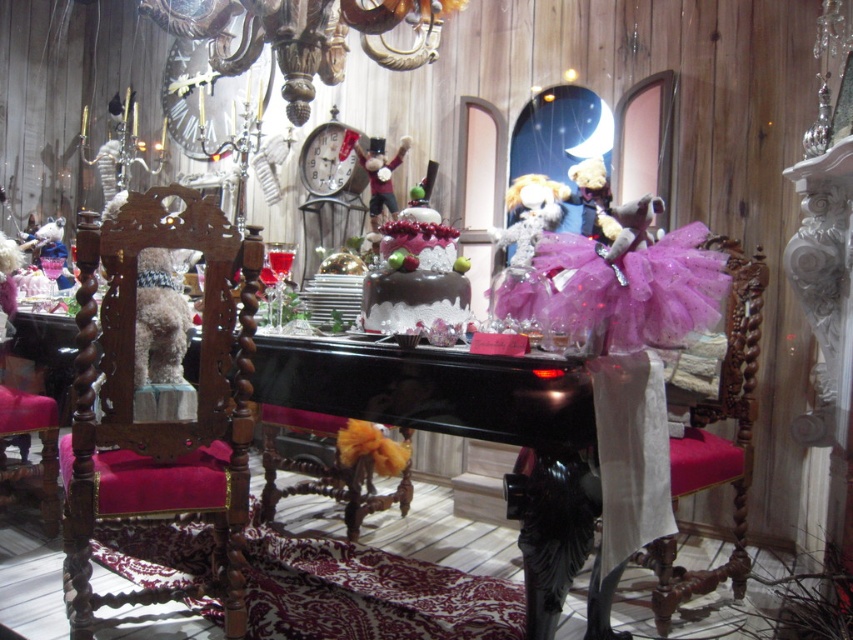
You are a photographer setting up for a photoshoot at this stage. You need to place a 1.2 meter wide backdrop behind the purple tulle dress at center and the fuzzy plush toy at center. Can both items fit side by side on the backdrop without overlapping?

The purple tulle dress at center is wider than the fuzzy plush toy at center. Since the backdrop is 1.2 meters wide, it depends on their combined widths. However, the description only states the dress is wider, not the exact measurements. Without knowing the exact widths, we cannot confirm if they fit together.

You are a stagehand preparing to move items on the piano. You need to place a 6 inch wide decorative plate between the fuzzy plush toy at center and the velvet teddy bear at center. Is there enough space?

The fuzzy plush toy at center is 6.23 inches away from the velvet teddy bear at center, so yes, there is enough space to place a 6 inch wide decorative plate between them since the distance is slightly larger than the plate.

You are a guest at a party in this room and want to sit down. There is a wooden chair with velvet cushion at center and a chocolate frosted cake at center. Which object is taller and would block your view if you sit on it?

The wooden chair with velvet cushion at center is much taller than the chocolate frosted cake at center, so sitting on it would block your view due to its height.